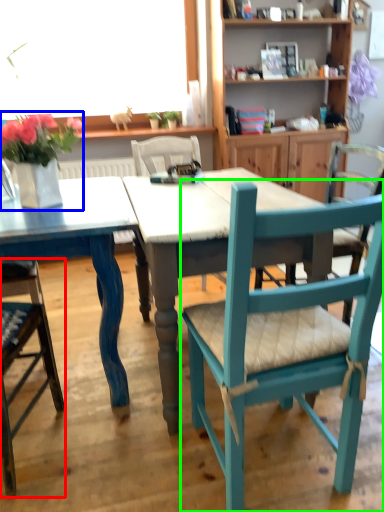
Question: Considering the real-world distances, which object is farthest from chair (highlighted by a red box)? floral arrangement (highlighted by a blue box) or chair (highlighted by a green box)?

Choices:
 (A) floral arrangement
 (B) chair

Answer: (B)